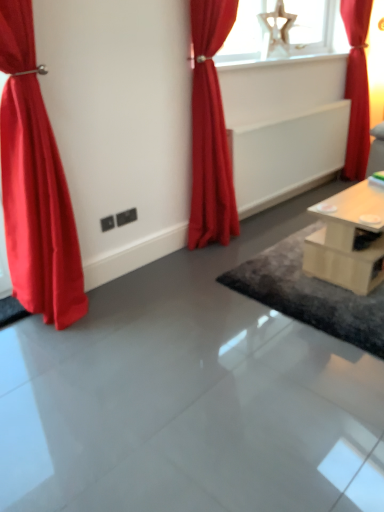
The width and height of the screenshot is (384, 512). In order to click on vacant space in matte red curtain at center, acting as the second curtain starting from the front (from a real-world perspective) in this screenshot , I will do `click(229, 240)`.